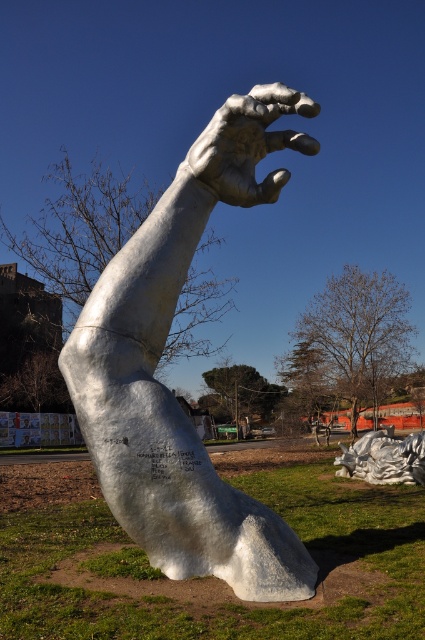
Is shiny silver hand at center positioned before shiny silver sculpture at lower right?

Yes, it is.

In order to click on shiny silver hand at center in this screenshot , I will do [x=249, y=144].

Between point (399, 600) and point (359, 467), which one is positioned in front?

Point (399, 600) is more forward.

Can you confirm if white marble sculpture at center is shorter than shiny silver sculpture at lower right?

Indeed, white marble sculpture at center has a lesser height compared to shiny silver sculpture at lower right.

The width and height of the screenshot is (425, 640). I want to click on white marble sculpture at center, so (x=209, y=577).

In the scene shown: Who is more distant from viewer, (135, 428) or (265, 198)?

The point (265, 198) is more distant.

Who is more forward, (149, 548) or (265, 109)?

Point (149, 548) is more forward.

You are a GUI agent. You are given a task and a screenshot of the screen. Output one action in this format:
    pyautogui.click(x=<x>, y=<y>)
    Task: Click on the white marble hand at center
    This screenshot has width=425, height=640.
    Given the screenshot: What is the action you would take?
    pyautogui.click(x=164, y=387)